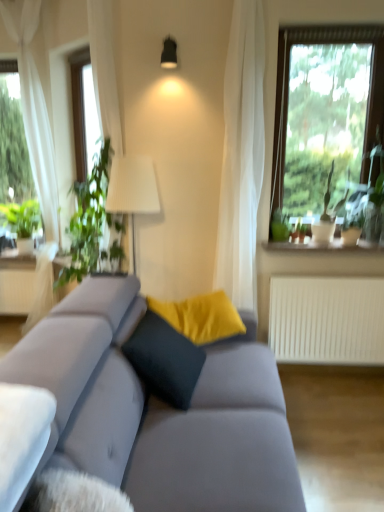
Question: In the image, is white ceramic vase at upper right positioned in front of or behind suede gray couch at center?

Choices:
 (A) behind
 (B) front

Answer: (A)

Question: Is white ceramic vase at upper right spatially inside suede gray couch at center, or outside of it?

Choices:
 (A) inside
 (B) outside

Answer: (B)

Question: Which object is the farthest from the green leafy plant at right?

Choices:
 (A) black matte lamp at upper center
 (B) white matte radiator at right
 (C) white sheer curtain at left
 (D) white ceramic vase at upper right
 (E) green leafy plant at left

Answer: (C)

Question: Estimate the real-world distances between objects in this image. Which object is closer to the suede gray couch at center?

Choices:
 (A) black matte lamp at upper center
 (B) white sheer curtain at left
 (C) white matte radiator at right
 (D) green leafy plant at left
 (E) green leafy plant at right

Answer: (C)